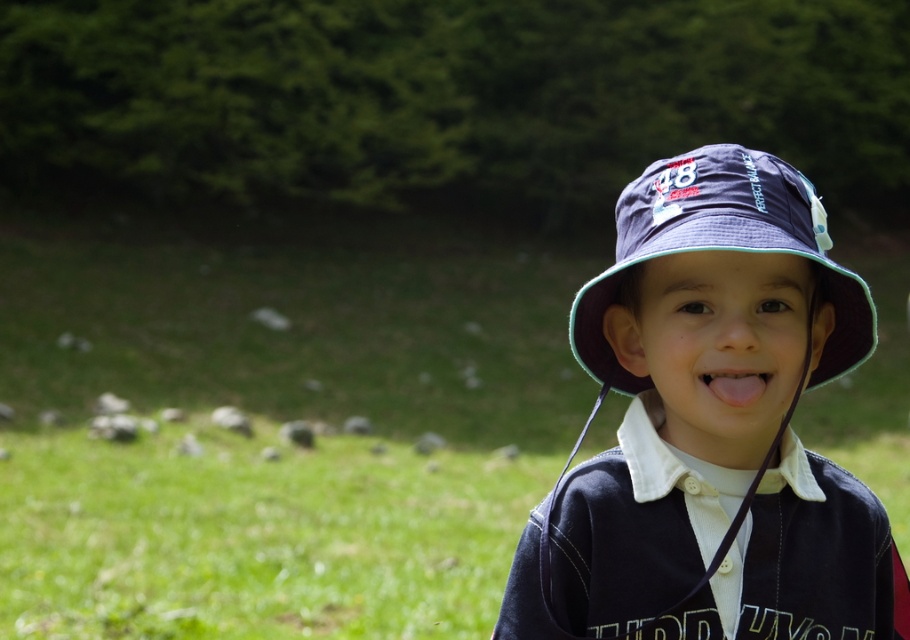
Question: Is navy blue fabric baseball hat at center smaller than pink flesh-colored tongue at center?

Choices:
 (A) yes
 (B) no

Answer: (B)

Question: Which object is positioned farthest from the navy blue fabric baseball hat at center?

Choices:
 (A) matte blue hat at center
 (B) green grass at center
 (C) pink flesh-colored tongue at center

Answer: (B)

Question: Which point is closer to the camera?

Choices:
 (A) pink flesh-colored tongue at center
 (B) green grass at center
 (C) matte blue hat at center
 (D) navy blue fabric baseball hat at center

Answer: (C)

Question: Can you confirm if matte blue hat at center is smaller than navy blue fabric baseball hat at center?

Choices:
 (A) no
 (B) yes

Answer: (A)

Question: Among these points, which one is nearest to the camera?

Choices:
 (A) (766, 376)
 (B) (877, 595)
 (C) (91, 396)
 (D) (733, 241)

Answer: (D)

Question: Is green grass at center wider than navy blue fabric baseball hat at center?

Choices:
 (A) no
 (B) yes

Answer: (B)